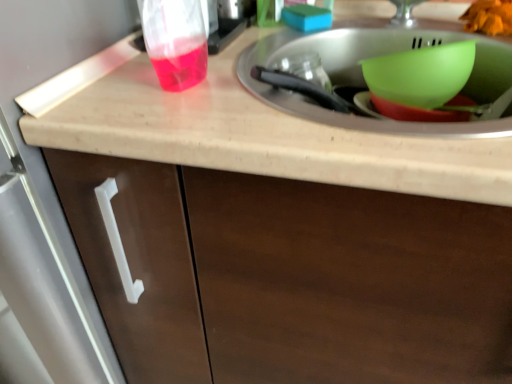
Question: From the image's perspective, is green plastic bowl at upper right above or below beige matte countertop at upper center?

Choices:
 (A) above
 (B) below

Answer: (A)

Question: In terms of height, does green plastic bowl at upper right look taller or shorter compared to beige matte countertop at upper center?

Choices:
 (A) short
 (B) tall

Answer: (A)

Question: Which object is positioned closest to the transparent plastic cup at upper left?

Choices:
 (A) green plastic bowl at upper right
 (B) orange matte food at upper right
 (C) brown matte cabinet at center
 (D) beige matte countertop at upper center
 (E) matte plastic sink at center

Answer: (E)

Question: Which object is the closest to the matte plastic sink at center?

Choices:
 (A) transparent plastic cup at upper left
 (B) green plastic bowl at upper right
 (C) brown matte cabinet at center
 (D) orange matte food at upper right
 (E) beige matte countertop at upper center

Answer: (B)